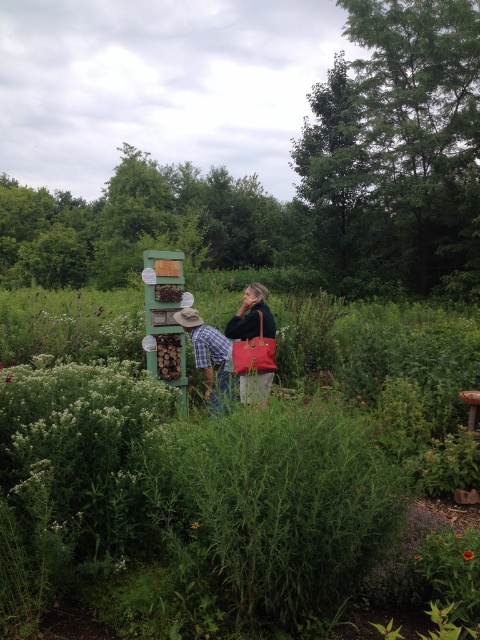
Between matte brown hat at center and purple matte flower at center, which one appears on the left side from the viewer's perspective?

From the viewer's perspective, matte brown hat at center appears more on the left side.

Who is positioned more to the right, matte brown hat at center or purple matte flower at center?

From the viewer's perspective, purple matte flower at center appears more on the right side.

Is point (203, 328) closer to viewer compared to point (420, 556)?

No.

Where is `matte brown hat at center`? This screenshot has width=480, height=640. matte brown hat at center is located at coordinates (247, 353).

Is point (238, 330) in front of point (240, 342)?

That is False.

Which is behind, point (229, 321) or point (242, 374)?

The point (229, 321) is more distant.

Describe the element at coordinates (247, 353) in the screenshot. The height and width of the screenshot is (640, 480). I see `matte brown hat at center` at that location.

Image resolution: width=480 pixels, height=640 pixels. Identify the location of matte brown hat at center. click(x=247, y=353).

Who is more distant from viewer, (239,333) or (196,522)?

The point (239,333) is more distant.

Can you confirm if matte brown hat at center is bigger than yellow matte flower at center?

Yes, matte brown hat at center is bigger than yellow matte flower at center.

Between point (261, 321) and point (192, 522), which one is positioned behind?

Point (261, 321)

Identify the location of matte brown hat at center. The width and height of the screenshot is (480, 640). (247, 353).